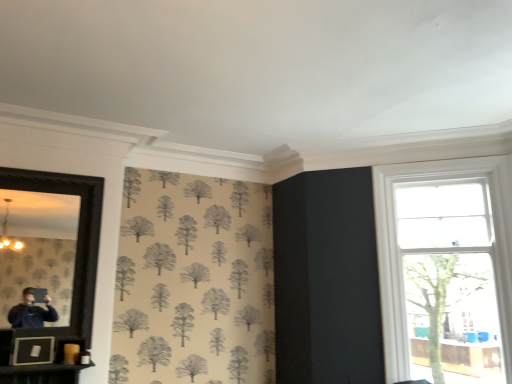
Question: From a real-world perspective, is clear glass window at right physically above matte black picture frame at lower left?

Choices:
 (A) no
 (B) yes

Answer: (B)

Question: From the image's perspective, is clear glass window at right beneath matte black picture frame at lower left?

Choices:
 (A) yes
 (B) no

Answer: (B)

Question: Considering the relative sizes of clear glass window at right and matte black picture frame at lower left in the image provided, is clear glass window at right wider than matte black picture frame at lower left?

Choices:
 (A) yes
 (B) no

Answer: (A)

Question: Considering the relative positions of clear glass window at right and matte black picture frame at lower left in the image provided, is clear glass window at right to the right of matte black picture frame at lower left from the viewer's perspective?

Choices:
 (A) no
 (B) yes

Answer: (B)

Question: Does clear glass window at right appear on the left side of matte black picture frame at lower left?

Choices:
 (A) no
 (B) yes

Answer: (A)

Question: Is clear glass window at right aimed at matte black picture frame at lower left?

Choices:
 (A) no
 (B) yes

Answer: (A)

Question: Is black framed mirror at left outside clear glass window at right?

Choices:
 (A) yes
 (B) no

Answer: (A)

Question: Considering the relative positions of black framed mirror at left and clear glass window at right in the image provided, is black framed mirror at left behind clear glass window at right?

Choices:
 (A) no
 (B) yes

Answer: (A)

Question: Can clear glass window at right be found inside black framed mirror at left?

Choices:
 (A) no
 (B) yes

Answer: (A)

Question: Could you tell me if black framed mirror at left is turned towards clear glass window at right?

Choices:
 (A) yes
 (B) no

Answer: (B)

Question: Is black framed mirror at left smaller than clear glass window at right?

Choices:
 (A) no
 (B) yes

Answer: (B)

Question: From a real-world perspective, is black framed mirror at left on top of clear glass window at right?

Choices:
 (A) yes
 (B) no

Answer: (A)

Question: Is clear glass window at right positioned beyond the bounds of black framed mirror at left?

Choices:
 (A) no
 (B) yes

Answer: (B)